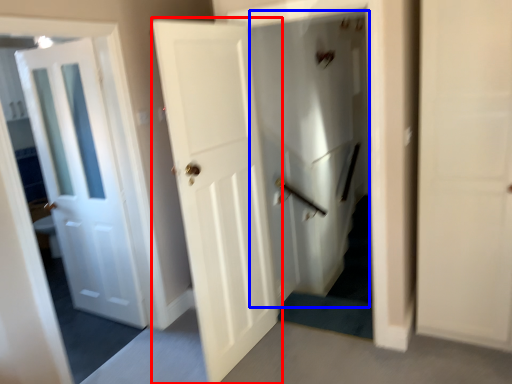
Question: Among these objects, which one is farthest to the camera, door (highlighted by a red box) or elevator (highlighted by a blue box)?

Choices:
 (A) door
 (B) elevator

Answer: (B)